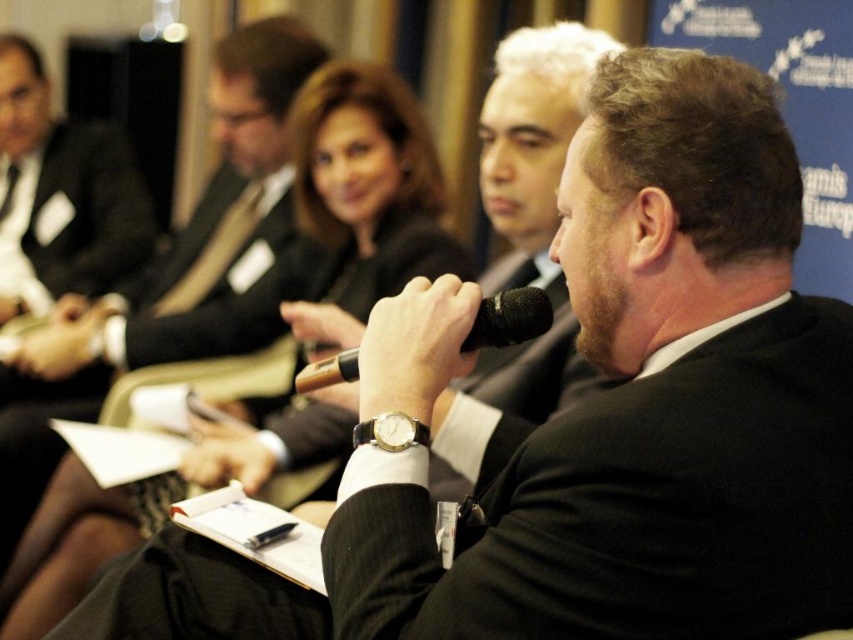
You are organizing a conference and need to ensure that the black matte suit at center and the black matte microphone at center can both fit on a 1.2 meter wide table. Based on their sizes, will they fit together?

The black matte suit at center has a larger size compared to black matte microphone at center. However, without specific measurements of each item, it is impossible to determine if they will fit on the 1.2 meter wide table. More information is needed about their individual dimensions.